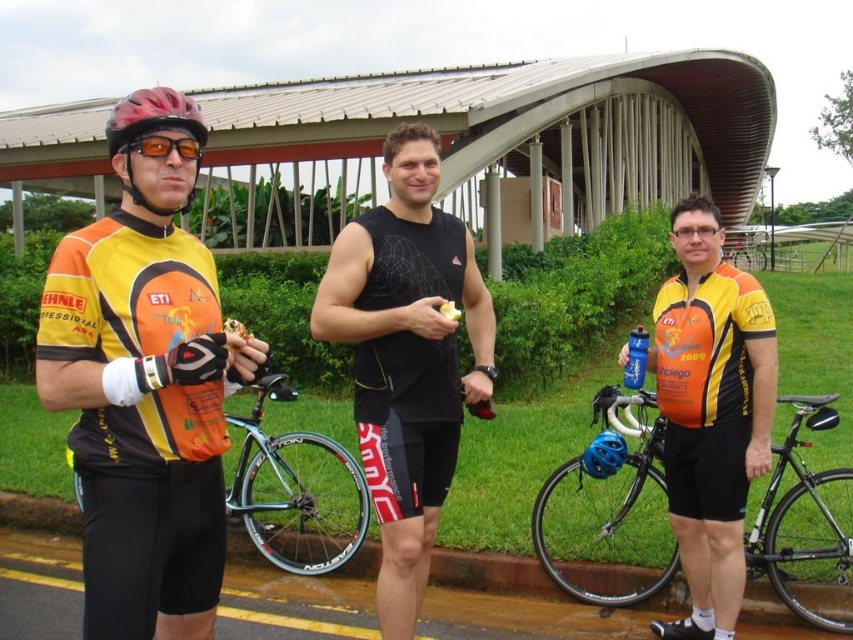
Based on the photo, between matte orange cycling jersey at center and shiny silver bicycle at center, which one has less height?

With less height is matte orange cycling jersey at center.

Can you confirm if matte orange cycling jersey at center is bigger than shiny silver bicycle at center?

No.

Who is more forward, (677, 509) or (722, 244)?

Point (722, 244)

Find the location of `matte orange cycling jersey at center`. matte orange cycling jersey at center is located at coordinates (711, 412).

In the scene shown: Can you confirm if black matte tank top at center is taller than shiny silver bicycle at center?

No.

Does black matte tank top at center come behind shiny silver bicycle at center?

No, black matte tank top at center is closer to the viewer.

You are a GUI agent. You are given a task and a screenshot of the screen. Output one action in this format:
    pyautogui.click(x=<x>, y=<y>)
    Task: Click on the black matte tank top at center
    
    Given the screenshot: What is the action you would take?
    pyautogui.click(x=405, y=358)

Where is `black matte tank top at center`? This screenshot has height=640, width=853. black matte tank top at center is located at coordinates (405, 358).

Between point (474, 358) and point (141, 141), which one is positioned behind?

Positioned behind is point (474, 358).

Identify the location of black matte tank top at center. (405, 358).